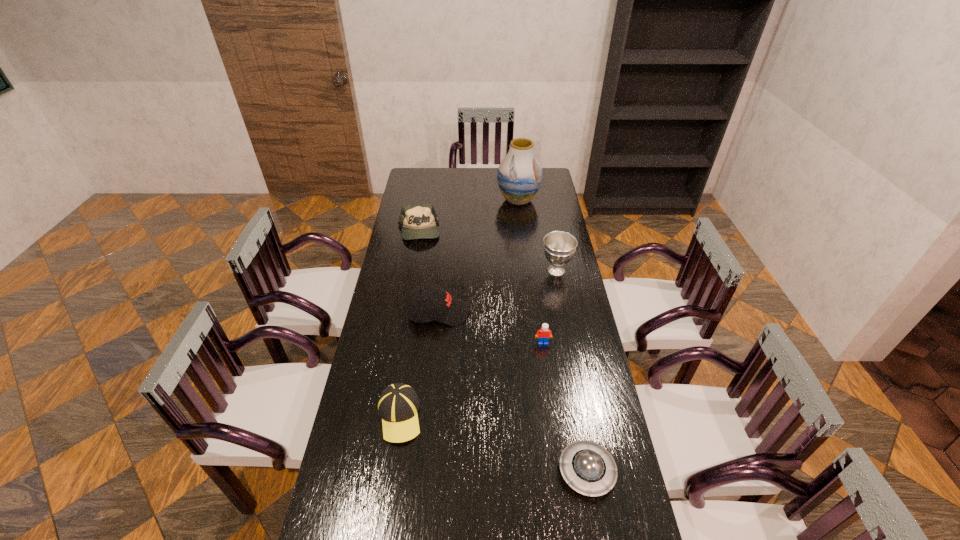
Identify the location of blank area in the image that satisfies the following two spatial constraints: 1. on the front-facing side of the second farthest baseball cap; 2. on the left side of the shortest object. click(423, 471).